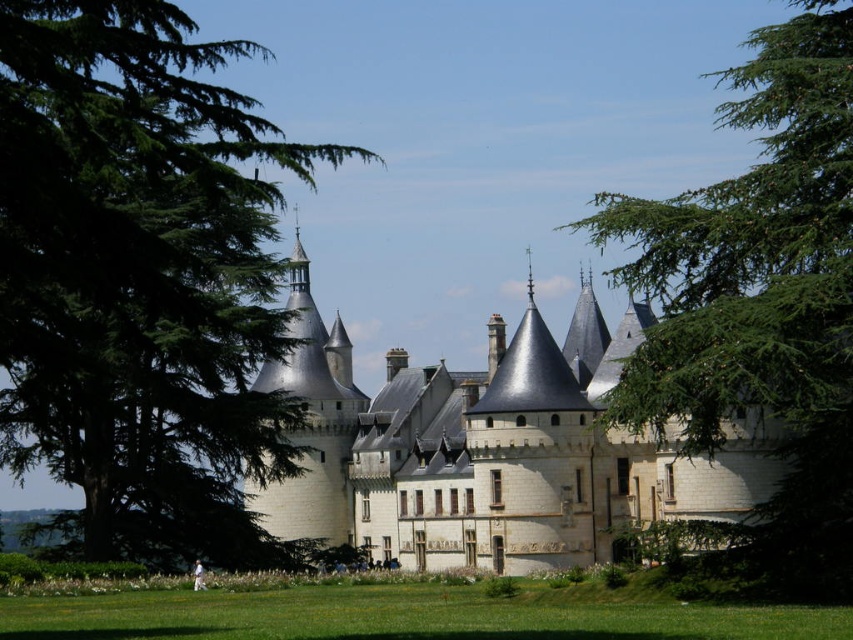
Question: Which point is farther to the camera?

Choices:
 (A) (141, 176)
 (B) (434, 454)

Answer: (B)

Question: Is green leafy tree at left wider than green textured leaves at center?

Choices:
 (A) no
 (B) yes

Answer: (B)

Question: In this image, where is green leafy tree at left located relative to smooth stone castle at center?

Choices:
 (A) left
 (B) right

Answer: (A)

Question: Among these objects, which one is nearest to the camera?

Choices:
 (A) smooth stone castle at center
 (B) green textured leaves at center
 (C) green leafy tree at left

Answer: (C)

Question: Is green leafy tree at left above smooth stone castle at center?

Choices:
 (A) yes
 (B) no

Answer: (A)

Question: Which point is closer to the camera?

Choices:
 (A) (647, 380)
 (B) (299, 500)
 (C) (242, 436)

Answer: (A)